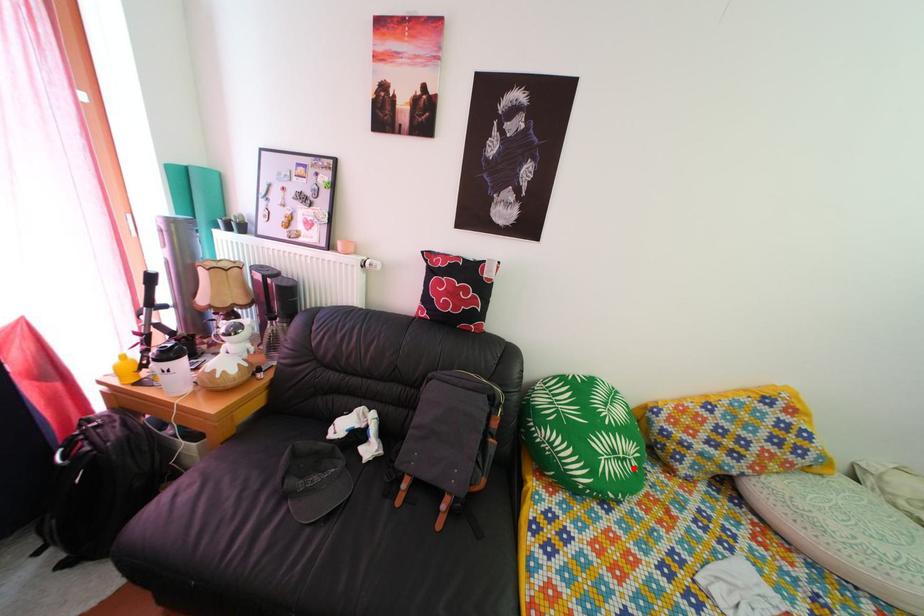
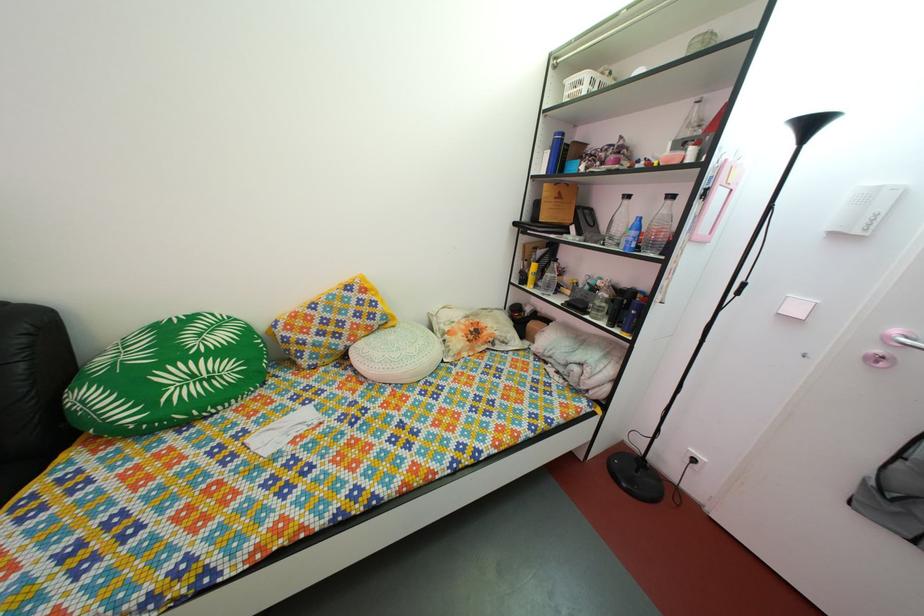
Locate, in the second image, the point that corresponds to the highlighted location in the first image.

(220, 387)